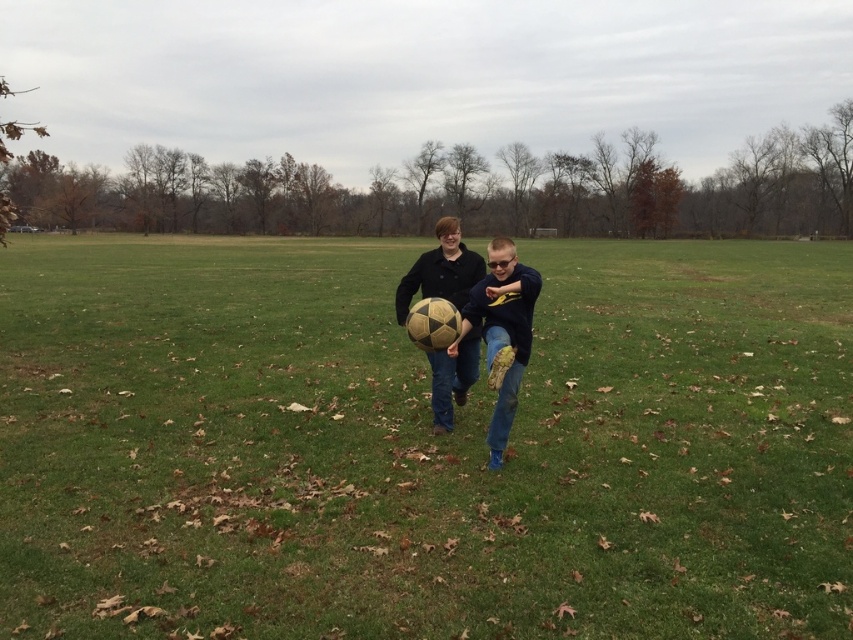
Question: Does green grass at center have a greater width compared to matte gold soccer ball at center?

Choices:
 (A) no
 (B) yes

Answer: (B)

Question: Does matte yellow soccer ball at center have a larger size compared to matte gold soccer ball at center?

Choices:
 (A) no
 (B) yes

Answer: (B)

Question: Which point is farther to the camera?

Choices:
 (A) matte yellow soccer ball at center
 (B) matte gold soccer ball at center

Answer: (B)

Question: Which of these objects is positioned farthest from the matte yellow soccer ball at center?

Choices:
 (A) matte gold soccer ball at center
 (B) green grass at center

Answer: (B)

Question: Based on their relative distances, which object is nearer to the matte gold soccer ball at center?

Choices:
 (A) matte yellow soccer ball at center
 (B) green grass at center

Answer: (A)

Question: Does matte yellow soccer ball at center have a greater width compared to matte gold soccer ball at center?

Choices:
 (A) no
 (B) yes

Answer: (B)